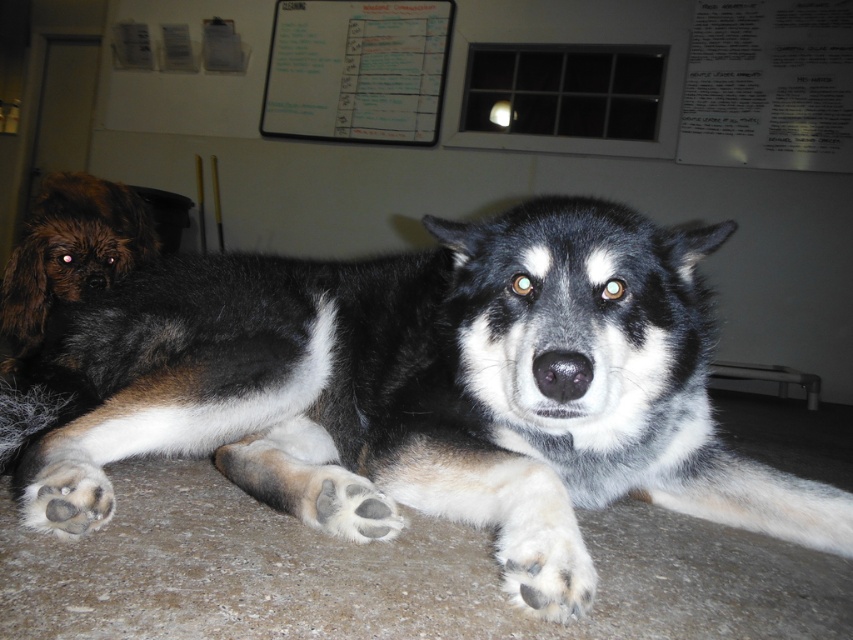
You are a dog owner trying to clean your home. You notice the gray concrete floor at center and the fuzzy fur paw at lower center. Which object is located to the right of the other?

The gray concrete floor at center is located to the right of the fuzzy fur paw at lower center.

You are a dog owner who wants to clean the gray concrete floor at center. You notice the fuzzy fur paw at lower center. Which object is bigger in size?

The gray concrete floor at center is larger in size than the fuzzy fur paw at lower center.

You are a dog owner who wants to place a new dog bed in the room. The bed requires a space wider than the white fur at lower center. Can the gray concrete floor at center accommodate the bed?

The gray concrete floor at center is wider than the white fur at lower center, so yes, the gray concrete floor at center can accommodate the dog bed.